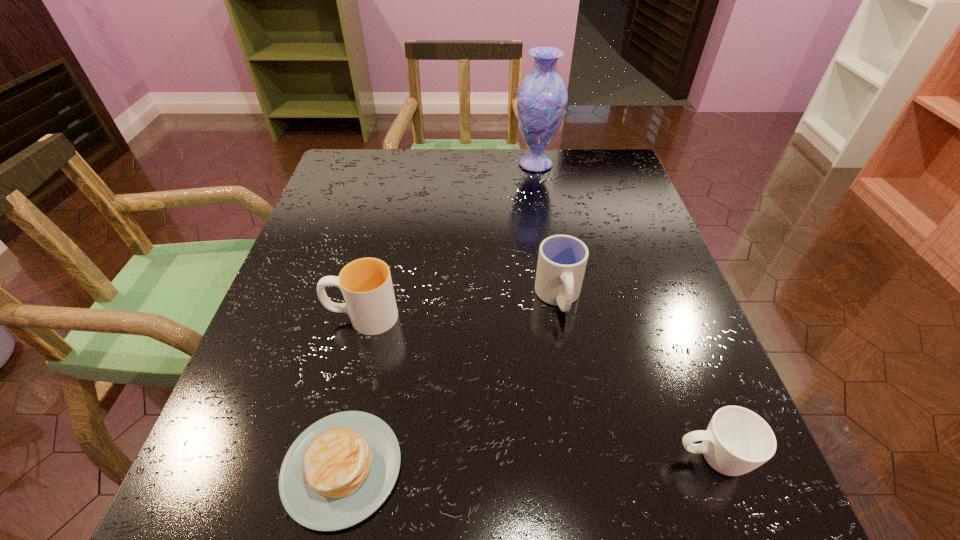
In order to click on free space located 0.180m with the handle on the side of the fourth tallest object in this screenshot , I will do `click(549, 458)`.

Image resolution: width=960 pixels, height=540 pixels. I want to click on free space located 0.100m with the handle on the side of the fourth tallest object, so click(604, 458).

What are the coordinates of `vacant area located on the back of the pancake` in the screenshot? It's located at (366, 360).

Where is `object that is at the far edge`? The width and height of the screenshot is (960, 540). object that is at the far edge is located at coordinates (542, 97).

What are the coordinates of `cup that is at the near edge` in the screenshot? It's located at (737, 440).

Where is `pancake positioned at the near edge`? pancake positioned at the near edge is located at coordinates (341, 469).

At what (x,y) coordinates should I click in order to perform the action: click on cup located in the left edge section of the desktop. Please return your answer as a coordinate pair (x, y). The width and height of the screenshot is (960, 540). Looking at the image, I should click on (366, 284).

Where is `pancake at the left edge`? The width and height of the screenshot is (960, 540). pancake at the left edge is located at coordinates (341, 469).

This screenshot has height=540, width=960. What are the coordinates of `object present at the right edge` in the screenshot? It's located at (737, 440).

Identify the location of object located at the near left corner. (341, 469).